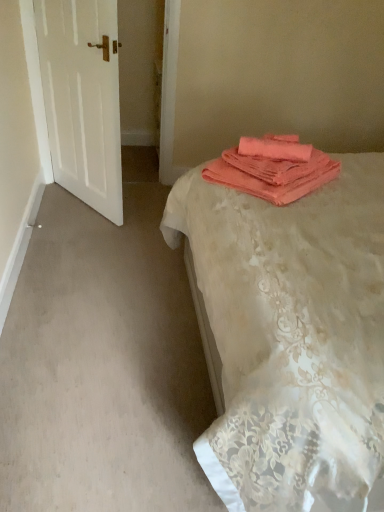
Question: Does coral fabric bed at center come behind coral fabric towels at upper right?

Choices:
 (A) no
 (B) yes

Answer: (A)

Question: Is coral fabric bed at center to the right of coral fabric towels at upper right from the viewer's perspective?

Choices:
 (A) no
 (B) yes

Answer: (B)

Question: Can you confirm if coral fabric bed at center is bigger than coral fabric towels at upper right?

Choices:
 (A) yes
 (B) no

Answer: (A)

Question: Does coral fabric bed at center touch coral fabric towels at upper right?

Choices:
 (A) no
 (B) yes

Answer: (A)

Question: Is coral fabric bed at center outside coral fabric towels at upper right?

Choices:
 (A) yes
 (B) no

Answer: (A)

Question: Can you confirm if coral fabric bed at center is shorter than coral fabric towels at upper right?

Choices:
 (A) yes
 (B) no

Answer: (B)

Question: Is coral fabric bed at center further to the viewer compared to white matte door at left?

Choices:
 (A) no
 (B) yes

Answer: (A)

Question: Does coral fabric bed at center have a lesser height compared to white matte door at left?

Choices:
 (A) no
 (B) yes

Answer: (A)

Question: Is coral fabric bed at center not near white matte door at left?

Choices:
 (A) yes
 (B) no

Answer: (A)

Question: Is coral fabric bed at center to the right of white matte door at left from the viewer's perspective?

Choices:
 (A) yes
 (B) no

Answer: (A)

Question: Can you confirm if coral fabric bed at center is taller than white matte door at left?

Choices:
 (A) no
 (B) yes

Answer: (B)

Question: From a real-world perspective, does coral fabric bed at center stand above white matte door at left?

Choices:
 (A) no
 (B) yes

Answer: (B)

Question: Is white matte door at left behind coral fabric bed at center?

Choices:
 (A) yes
 (B) no

Answer: (A)